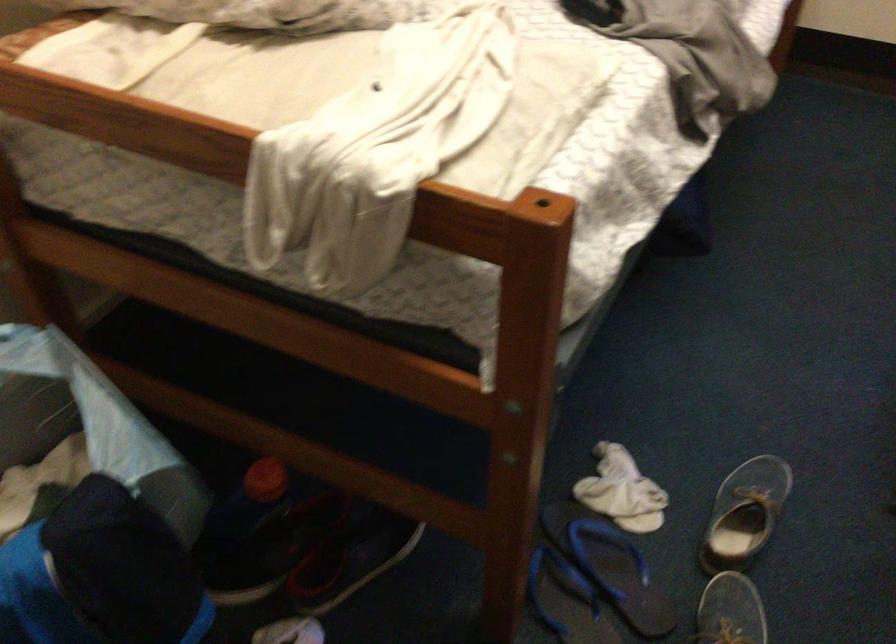
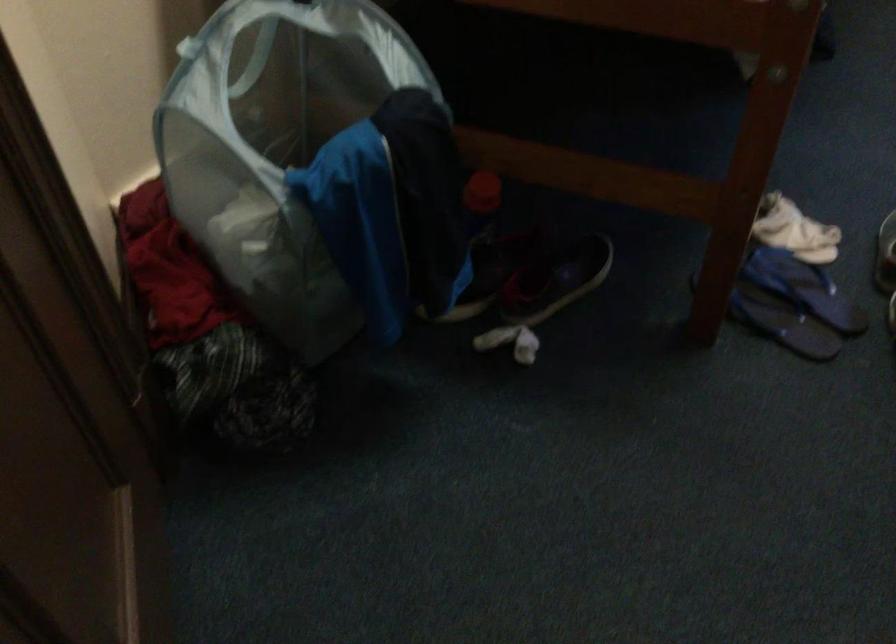
The point at (263, 491) is marked in the first image. Where is the corresponding point in the second image?

(480, 202)